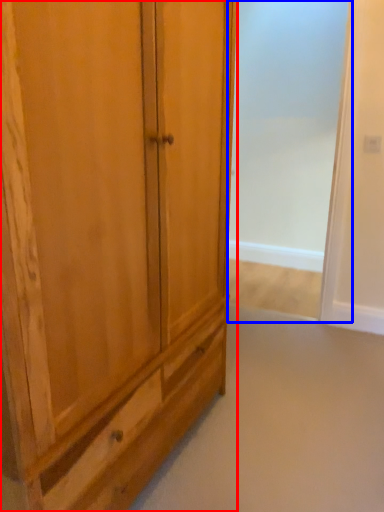
Question: Among these objects, which one is nearest to the camera, cupboard (highlighted by a red box) or screen door (highlighted by a blue box)?

Choices:
 (A) cupboard
 (B) screen door

Answer: (A)